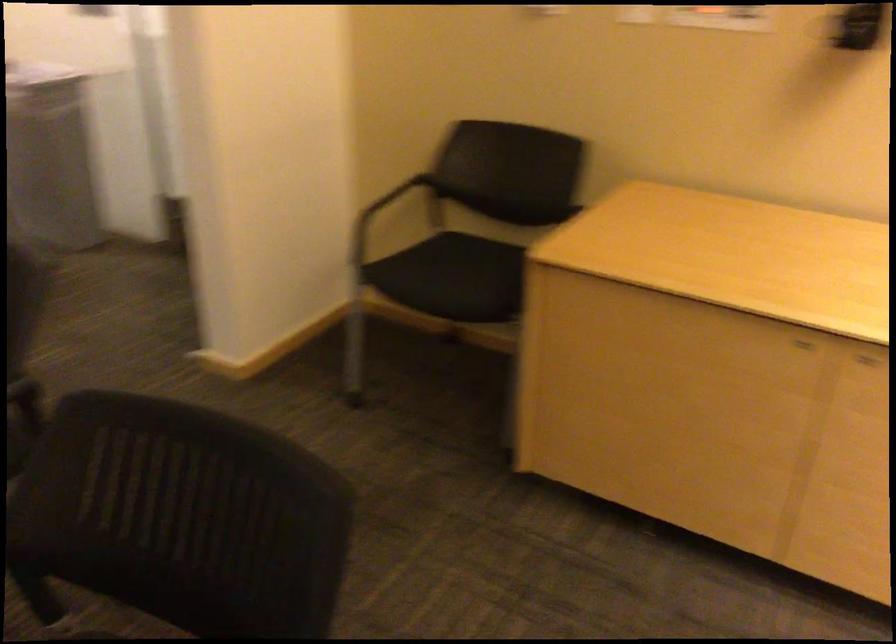
Where is `black chair armrest`? black chair armrest is located at coordinates (412, 196).